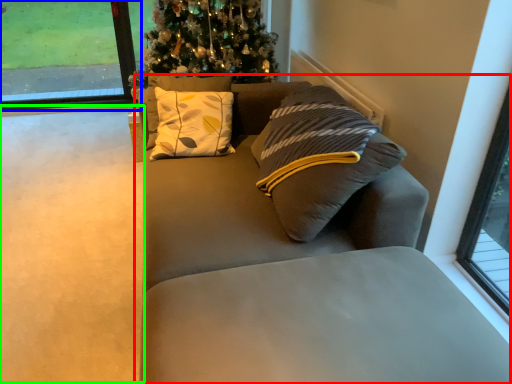
Question: Estimate the real-world distances between objects in this image. Which object is farther from studio couch (highlighted by a red box), window (highlighted by a blue box) or golf course (highlighted by a green box)?

Choices:
 (A) window
 (B) golf course

Answer: (A)